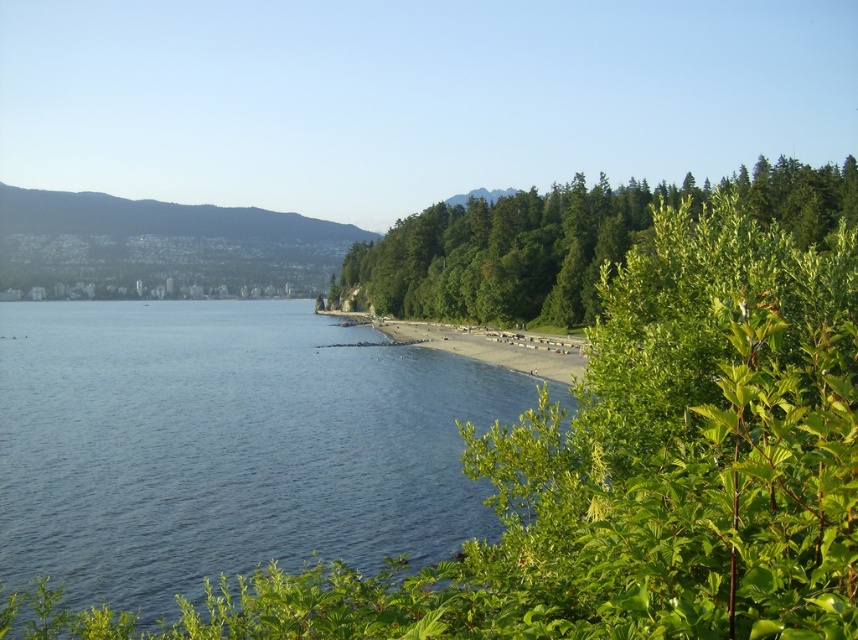
You are standing on the beach and want to walk to the green leafy trees at center. Which direction should you head to avoid the blue water at lower left?

To reach the green leafy trees at center without encountering the blue water at lower left, you should head to the right, as the blue water at lower left is located to the left of the green leafy trees at center.

You are a photographer planning to capture the blue water at lower left and the green leafy trees at center in a single shot. Based on their sizes in the image, which object would appear more prominent in the final photograph?

The green leafy trees at center would appear more prominent in the photograph since they are larger than the blue water at lower left.

You are standing on the beach and see the blue water at lower left and the green leafy trees at center. Which object is closer to the horizon?

The blue water at lower left is positioned under green leafy trees at center, meaning it is closer to the horizon than the trees.